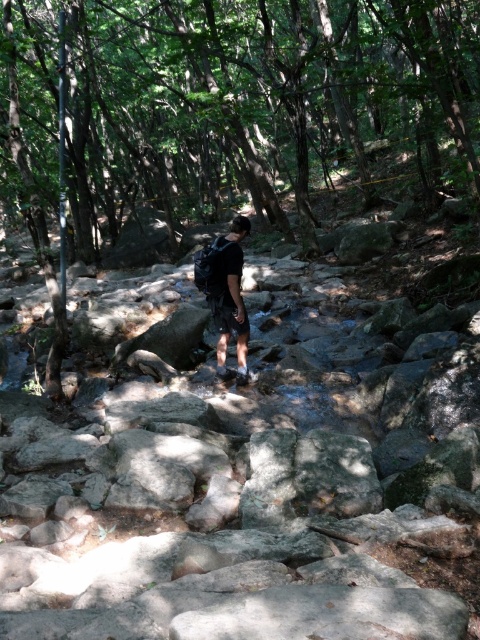
You are a hiker who wants to take a photo of the dark gray backpack at center without the green leafy tree at center blocking the view. Is it possible to do so based on their heights?

The green leafy tree at center is taller than the dark gray backpack at center, so if you position yourself so that the backpack is in front of the tree, the tree won

You are a hiker trying to locate a specific point marked on a map. The coordinates given are point (x=228, y=109). Based on the scene, where would this point be located?

The point (x=228, y=109) is located on the green leafy tree at center.

You are a hiker trying to reach a destination located at point [238,353]. You are currently at point [132,170]. Based on the scene, which direction should you move to get closer to your destination?

Point [132,170] is behind point [238,353], so you should move forward in the direction of point [238,353] to get closer.